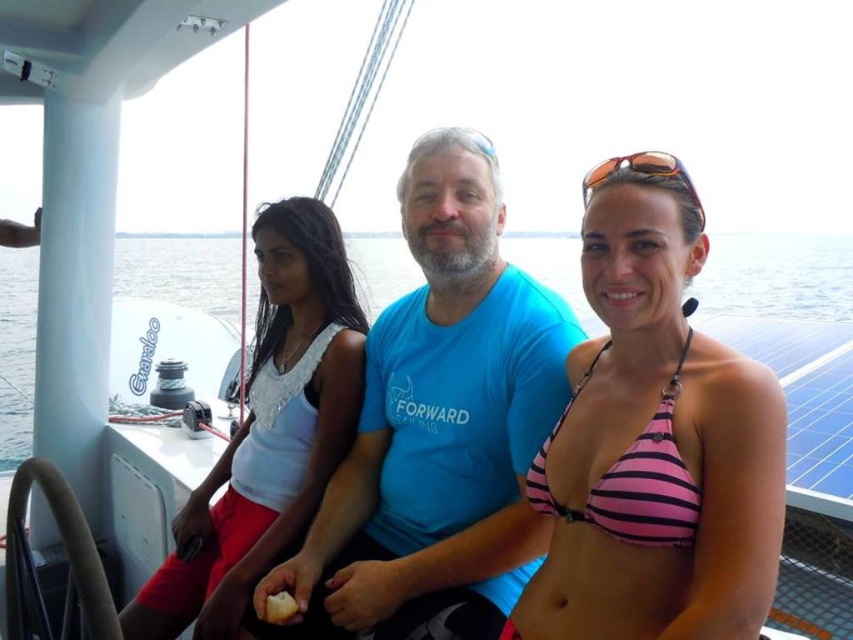
Question: Can you confirm if clear blue water at center is positioned to the right of pink striped bikini top at center right?

Choices:
 (A) no
 (B) yes

Answer: (B)

Question: Does white lace top at center have a lesser width compared to orange plastic sunglasses at center?

Choices:
 (A) no
 (B) yes

Answer: (A)

Question: Which point is farther to the camera?

Choices:
 (A) (264, 531)
 (B) (840, 296)
 (C) (660, 582)

Answer: (B)

Question: Is blue t-shirt at center smaller than pink striped bikini top at center right?

Choices:
 (A) yes
 (B) no

Answer: (B)

Question: Which of these objects is positioned farthest from the white lace top at center?

Choices:
 (A) pink striped bikini top at center
 (B) pink striped bikini top at center right
 (C) blue t-shirt at center
 (D) clear blue water at center

Answer: (D)

Question: Among these objects, which one is nearest to the camera?

Choices:
 (A) blue t-shirt at center
 (B) pink striped bikini top at center right

Answer: (B)